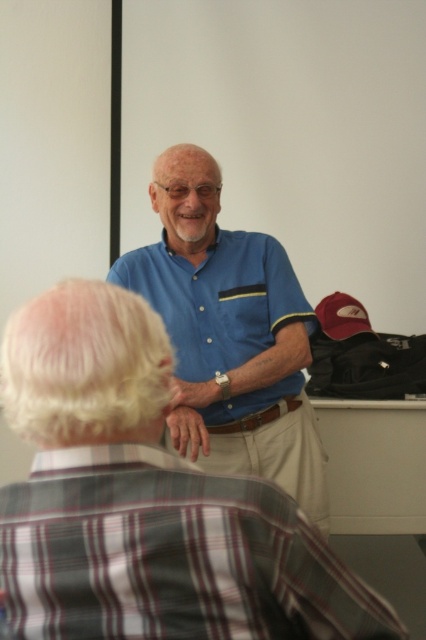
From the picture: Can you confirm if plaid cotton shirt at lower left is positioned above blue cotton shirt at center?

Incorrect, plaid cotton shirt at lower left is not positioned above blue cotton shirt at center.

Between plaid cotton shirt at lower left and blue cotton shirt at center, which one appears on the left side from the viewer's perspective?

plaid cotton shirt at lower left is more to the left.

Is point (106, 468) behind point (284, 349)?

No.

The width and height of the screenshot is (426, 640). Identify the location of plaid cotton shirt at lower left. (170, 556).

Which of these two, plaid cotton shirt at lower left or matte blue polo shirt at center, stands shorter?

plaid cotton shirt at lower left

Is plaid cotton shirt at lower left in front of matte blue polo shirt at center?

That is True.

Who is more forward, (52, 509) or (215, 310)?

Positioned in front is point (52, 509).

Find the location of a particular element. Image resolution: width=426 pixels, height=640 pixels. plaid cotton shirt at lower left is located at coordinates (170, 556).

Does blue cotton shirt at center have a smaller size compared to matte blue polo shirt at center?

No, blue cotton shirt at center is not smaller than matte blue polo shirt at center.

Describe the element at coordinates (230, 333) in the screenshot. This screenshot has height=640, width=426. I see `blue cotton shirt at center` at that location.

Image resolution: width=426 pixels, height=640 pixels. I want to click on blue cotton shirt at center, so click(230, 333).